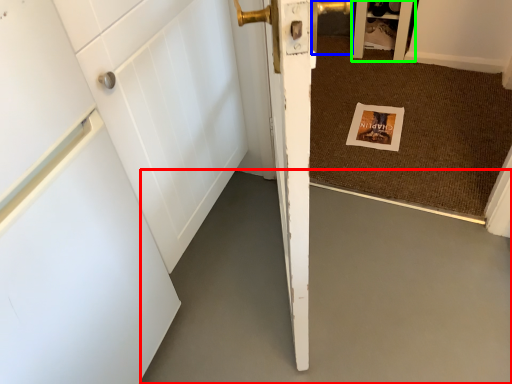
Question: Which object is positioned farthest from concrete (highlighted by a red box)? Select from door handle (highlighted by a blue box) and cabinetry (highlighted by a green box).

Choices:
 (A) door handle
 (B) cabinetry

Answer: (A)